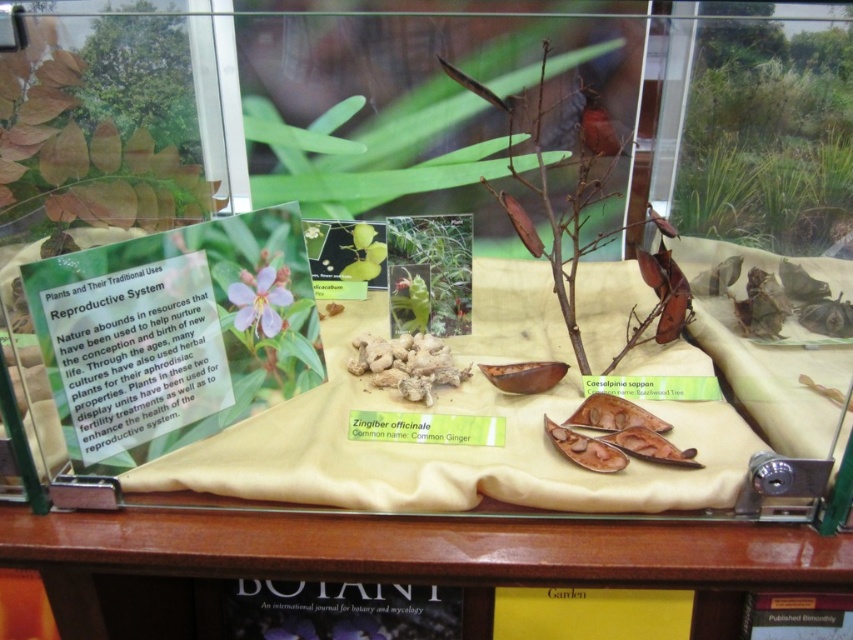
You are standing 20 inches away from the glass case in the botanical display. There is a point marked at coordinates point (338, 467) inside the case. Can you reach this point without moving your position?

The distance of point (338, 467) from viewer is 30.28 inches. Since you are only 20 inches away from the glass case, you cannot reach the point as it is farther than your current distance.

You are a botany student observing the display case. You need to locate the purple matte flower at upper center for your study. Where should you look relative to the beige fabric at center?

The purple matte flower at upper center is above the beige fabric at center.

You are a botanist who needs to place a 12 inch ruler between the beige fabric at center and another object in the scene. Is there enough space to place it without overlapping?

The beige fabric at center and the other object are 28.31 inches apart. Since the ruler is 12 inches long, there is sufficient space to place it between them without overlapping.